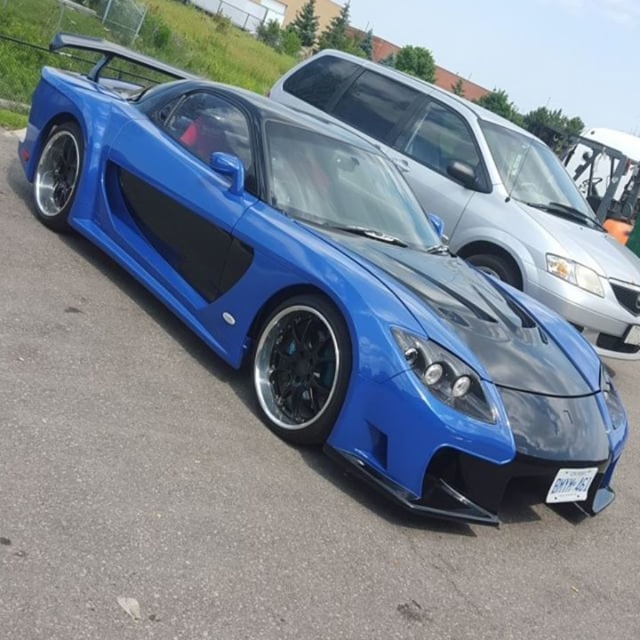
Question: Which point appears closest to the camera in this image?

Choices:
 (A) (566, 476)
 (B) (460, 140)

Answer: (A)

Question: Considering the real-world distances, which object is farthest from the glossy blue sports car at center?

Choices:
 (A) white plastic license plate at lower center
 (B) shiny blue sports car at center

Answer: (A)

Question: Which of the following is the closest to the observer?

Choices:
 (A) glossy blue sports car at center
 (B) shiny blue sports car at center
 (C) white plastic license plate at lower center

Answer: (B)

Question: Does shiny blue sports car at center appear under white plastic license plate at lower center?

Choices:
 (A) yes
 (B) no

Answer: (B)

Question: In this image, where is glossy blue sports car at center located relative to white plastic license plate at lower center?

Choices:
 (A) below
 (B) above

Answer: (B)

Question: From the image, what is the correct spatial relationship of shiny blue sports car at center in relation to white plastic license plate at lower center?

Choices:
 (A) right
 (B) left

Answer: (B)